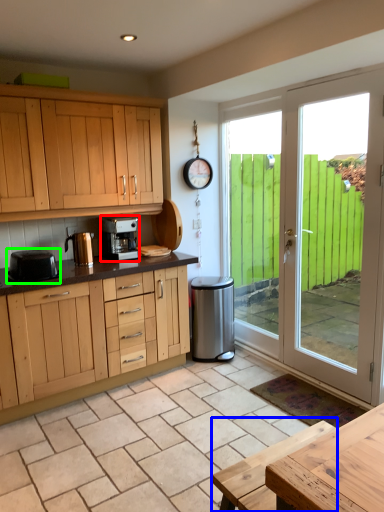
Question: Estimate the real-world distances between objects in this image. Which object is farther from kitchen appliance (highlighted by a red box), table (highlighted by a blue box) or kitchen appliance (highlighted by a green box)?

Choices:
 (A) table
 (B) kitchen appliance

Answer: (A)